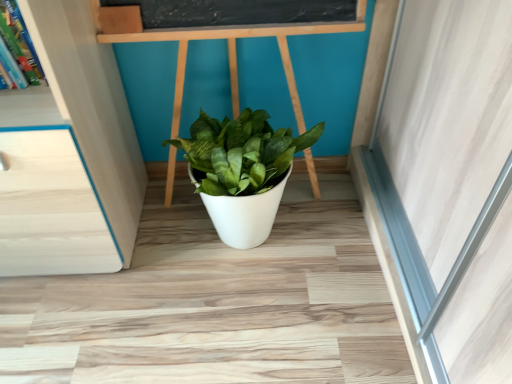
Locate an element on the screen. The width and height of the screenshot is (512, 384). wooden bookshelf at upper left is located at coordinates (32, 107).

What do you see at coordinates (32, 107) in the screenshot? The width and height of the screenshot is (512, 384). I see `wooden bookshelf at upper left` at bounding box center [32, 107].

Image resolution: width=512 pixels, height=384 pixels. I want to click on white matte pot at center, so click(x=242, y=171).

Measure the distance between white matte pot at center and camera.

white matte pot at center and camera are 1.03 meters apart.

The height and width of the screenshot is (384, 512). What do you see at coordinates (242, 171) in the screenshot?
I see `white matte pot at center` at bounding box center [242, 171].

Locate an element on the screen. Image resolution: width=512 pixels, height=384 pixels. wooden bookshelf at upper left is located at coordinates (32, 107).

Can you confirm if white matte pot at center is positioned to the left of wooden bookshelf at upper left?

No, white matte pot at center is not to the left of wooden bookshelf at upper left.

In the scene shown: Considering the positions of objects white matte pot at center and wooden bookshelf at upper left in the image provided, who is behind, white matte pot at center or wooden bookshelf at upper left?

white matte pot at center.

Is point (249, 209) less distant than point (24, 96)?

That is False.

From the image's perspective, which one is positioned lower, white matte pot at center or wooden bookshelf at upper left?

From the image's view, white matte pot at center is below.

From a real-world perspective, is white matte pot at center positioned over wooden bookshelf at upper left based on gravity?

No, from a real-world perspective, white matte pot at center is not on top of wooden bookshelf at upper left.

Which object is thinner, white matte pot at center or wooden bookshelf at upper left?

With smaller width is wooden bookshelf at upper left.

In the scene shown: Can you confirm if white matte pot at center is shorter than wooden bookshelf at upper left?

Incorrect, the height of white matte pot at center does not fall short of that of wooden bookshelf at upper left.

Can you confirm if white matte pot at center is smaller than wooden bookshelf at upper left?

Actually, white matte pot at center might be larger than wooden bookshelf at upper left.

Is white matte pot at center outside of wooden bookshelf at upper left?

Yes, white matte pot at center is outside of wooden bookshelf at upper left.

Is white matte pot at center not near wooden bookshelf at upper left?

No.

Does white matte pot at center turn towards wooden bookshelf at upper left?

No, white matte pot at center is not turned towards wooden bookshelf at upper left.

Can you tell me how much white matte pot at center and wooden bookshelf at upper left differ in facing direction?

The facing directions of white matte pot at center and wooden bookshelf at upper left are 0.000121 degrees apart.

Measure the distance between white matte pot at center and wooden bookshelf at upper left.

white matte pot at center and wooden bookshelf at upper left are 44.09 centimeters apart from each other.

This screenshot has width=512, height=384. Find the location of `shelf on the left of white matte pot at center`. shelf on the left of white matte pot at center is located at coordinates (32, 107).

Considering the relative positions of wooden bookshelf at upper left and white matte pot at center in the image provided, is wooden bookshelf at upper left to the right of white matte pot at center from the viewer's perspective?

In fact, wooden bookshelf at upper left is to the left of white matte pot at center.

Based on the photo, between wooden bookshelf at upper left and white matte pot at center, which one is positioned behind?

white matte pot at center is further away from the camera.

Which point is more distant from viewer, (36, 110) or (245, 210)?

The point (245, 210) is more distant.

From the image's perspective, is wooden bookshelf at upper left on top of white matte pot at center?

Indeed, from the image's perspective, wooden bookshelf at upper left is shown above white matte pot at center.

In the scene shown: From a real-world perspective, which object rests below the other?

white matte pot at center.

Can you confirm if wooden bookshelf at upper left is thinner than white matte pot at center?

Indeed, wooden bookshelf at upper left has a lesser width compared to white matte pot at center.

Is wooden bookshelf at upper left taller or shorter than white matte pot at center?

Clearly, wooden bookshelf at upper left is shorter compared to white matte pot at center.

In terms of size, does wooden bookshelf at upper left appear bigger or smaller than white matte pot at center?

Considering their sizes, wooden bookshelf at upper left takes up less space than white matte pot at center.

Would you say white matte pot at center is part of wooden bookshelf at upper left's contents?

No, white matte pot at center is not inside wooden bookshelf at upper left.

Is wooden bookshelf at upper left next to white matte pot at center?

wooden bookshelf at upper left is not next to white matte pot at center, and they're not touching.

Is wooden bookshelf at upper left oriented away from white matte pot at center?

wooden bookshelf at upper left is not turned away from white matte pot at center.

Find the location of `houseplant that is below the wooden bookshelf at upper left (from the image's perspective)`. houseplant that is below the wooden bookshelf at upper left (from the image's perspective) is located at coordinates coord(242,171).

The height and width of the screenshot is (384, 512). What are the coordinates of `shelf that is in front of the white matte pot at center` in the screenshot? It's located at (32, 107).

You are a GUI agent. You are given a task and a screenshot of the screen. Output one action in this format:
    pyautogui.click(x=<x>, y=<y>)
    Task: Click on the houseplant located below the wooden bookshelf at upper left (from the image's perspective)
    The width and height of the screenshot is (512, 384).
    Given the screenshot: What is the action you would take?
    pyautogui.click(x=242, y=171)